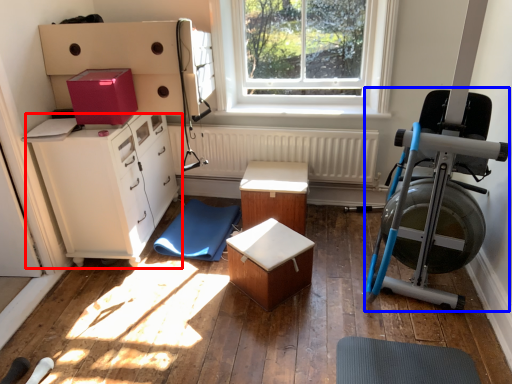
Question: Among these objects, which one is nearest to the camera, chest of drawers (highlighted by a red box) or baby carriage (highlighted by a blue box)?

Choices:
 (A) chest of drawers
 (B) baby carriage

Answer: (B)